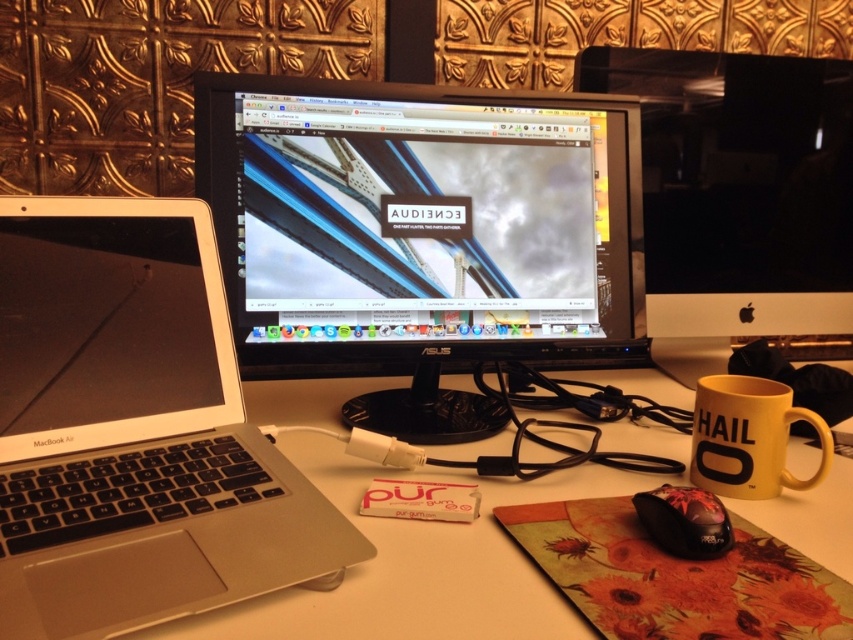
Which of these two, satin black laptop at left or yellow matte mug at lower right, stands shorter?

yellow matte mug at lower right is shorter.

Who is lower down, satin black laptop at left or yellow matte mug at lower right?

yellow matte mug at lower right

Where is `satin black laptop at left`? satin black laptop at left is located at coordinates (109, 324).

Does black plastic monitor at center have a greater height compared to black glossy mouse at lower right?

Correct, black plastic monitor at center is much taller as black glossy mouse at lower right.

Based on the photo, is black plastic monitor at center shorter than black glossy mouse at lower right?

No, black plastic monitor at center is not shorter than black glossy mouse at lower right.

Is point (473, 122) positioned after point (646, 500)?

Yes.

This screenshot has width=853, height=640. Identify the location of black plastic monitor at center. (421, 230).

The height and width of the screenshot is (640, 853). Describe the element at coordinates (740, 186) in the screenshot. I see `black glossy monitor at center` at that location.

Which is in front, point (842, 198) or point (80, 336)?

Point (80, 336) is in front.

The width and height of the screenshot is (853, 640). Identify the location of black glossy monitor at center. (740, 186).

Identify the location of black glossy monitor at center. (740, 186).